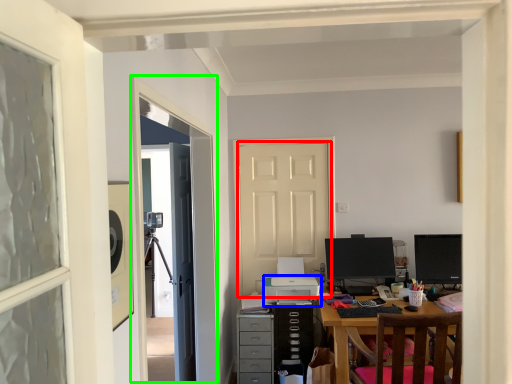
Question: Based on their relative distances, which object is farther from door (highlighted by a red box)? Choose from printer (highlighted by a blue box) and screen door (highlighted by a green box).

Choices:
 (A) printer
 (B) screen door

Answer: (B)